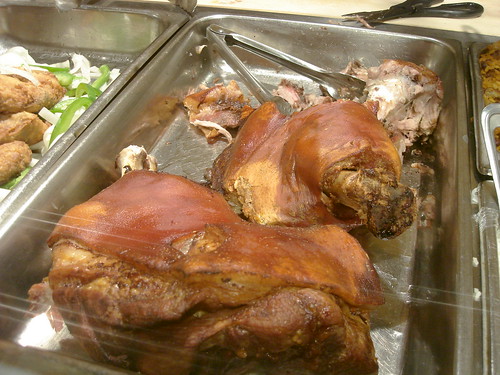
Identify the location of buffet. This screenshot has height=375, width=500. (196, 145).